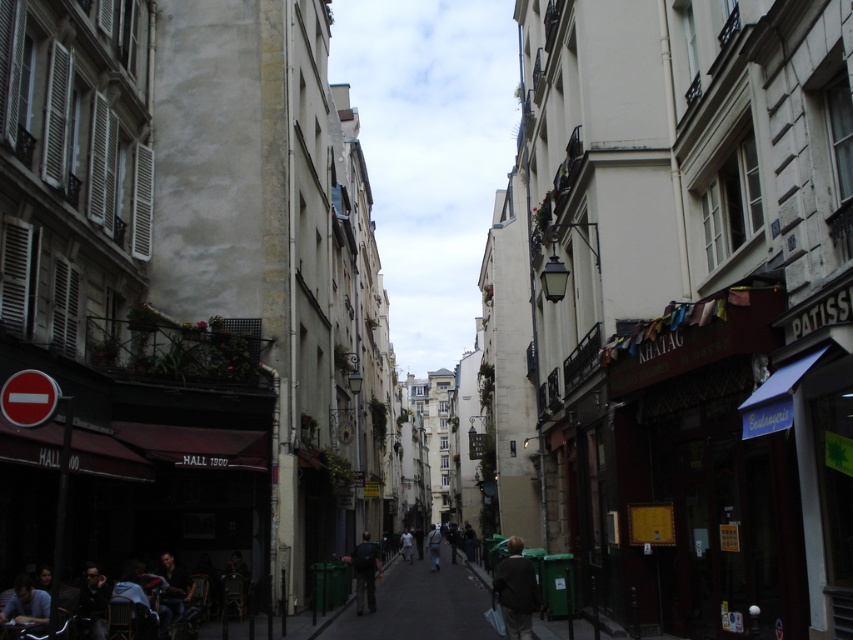
You are standing at the entrance of the street and want to find the dark blue jeans at lower left. Based on the coordinates provided, in which direction should you look to locate them?

The dark blue jeans at lower left is located at point (172, 589), which means you should look towards the lower left direction to find them.

You are a delivery person trying to navigate through the narrow street. You see a dark brown leather jacket at lower left and a white matte person at center. Which object is narrower so you can pass through more easily?

The dark brown leather jacket at lower left is thinner than the white matte person at center, so it is narrower and you can pass through more easily.